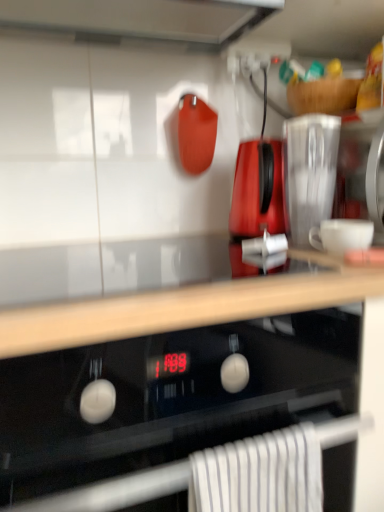
Question: Can you confirm if white striped towel at lower center is positioned to the left of wooden at upper center?

Choices:
 (A) yes
 (B) no

Answer: (B)

Question: From a real-world perspective, is white striped towel at lower center physically below wooden at upper center?

Choices:
 (A) no
 (B) yes

Answer: (B)

Question: Considering the relative sizes of white striped towel at lower center and wooden at upper center in the image provided, is white striped towel at lower center thinner than wooden at upper center?

Choices:
 (A) yes
 (B) no

Answer: (A)

Question: Is white striped towel at lower center further to camera compared to wooden at upper center?

Choices:
 (A) yes
 (B) no

Answer: (A)

Question: Is white striped towel at lower center positioned with its back to wooden at upper center?

Choices:
 (A) no
 (B) yes

Answer: (A)

Question: Is translucent plastic blender at center, the first kitchen appliance when ordered from right to left, wider or thinner than wooden at upper center?

Choices:
 (A) wide
 (B) thin

Answer: (B)

Question: Does point (317, 157) appear closer or farther from the camera than point (23, 320)?

Choices:
 (A) closer
 (B) farther

Answer: (B)

Question: From their relative heights in the image, would you say translucent plastic blender at center, which is the 2th kitchen appliance in left-to-right order, is taller or shorter than wooden at upper center?

Choices:
 (A) tall
 (B) short

Answer: (A)

Question: Based on their sizes in the image, would you say translucent plastic blender at center, the first kitchen appliance when ordered from right to left, is bigger or smaller than wooden at upper center?

Choices:
 (A) big
 (B) small

Answer: (B)

Question: Is point (276, 222) closer or farther from the camera than point (215, 268)?

Choices:
 (A) closer
 (B) farther

Answer: (B)

Question: From the image's perspective, is glossy plastic kettle at center, arranged as the 2th kitchen appliance when viewed from the right, positioned above or below wooden at upper center?

Choices:
 (A) below
 (B) above

Answer: (B)

Question: In the image, is glossy plastic kettle at center, arranged as the 2th kitchen appliance when viewed from the right, on the left side or the right side of wooden at upper center?

Choices:
 (A) right
 (B) left

Answer: (A)

Question: Considering the positions of glossy plastic kettle at center, arranged as the 2th kitchen appliance when viewed from the right, and wooden at upper center in the image, is glossy plastic kettle at center, arranged as the 2th kitchen appliance when viewed from the right, wider or thinner than wooden at upper center?

Choices:
 (A) wide
 (B) thin

Answer: (B)

Question: Relative to translucent plastic blender at center, which is the 2th kitchen appliance in left-to-right order, is black glass oven at center in front or behind?

Choices:
 (A) front
 (B) behind

Answer: (A)

Question: Is black glass oven at center bigger or smaller than translucent plastic blender at center, which is the 2th kitchen appliance in left-to-right order?

Choices:
 (A) big
 (B) small

Answer: (A)